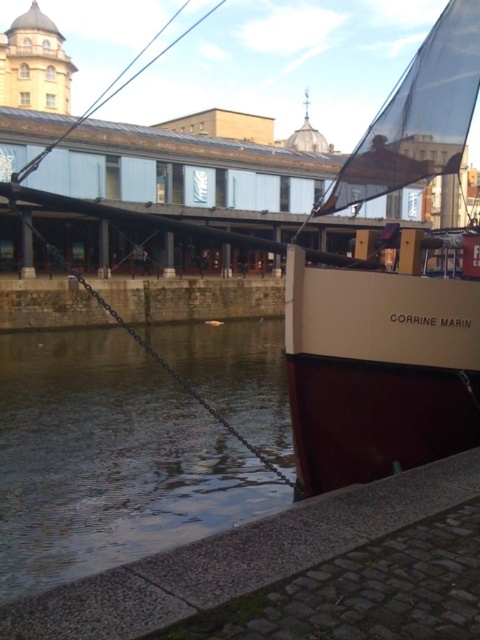
You are standing on the dock and looking at the smooth water at lower left and the beige matte sailboat at right. Which object appears taller from your perspective?

The beige matte sailboat at right appears taller than the smooth water at lower left because the smooth water at lower left is shorter than the beige matte sailboat at right.

You are standing on the dock and want to throw a pebble to the smooth water at lower left. If your throwing range is 5 meters, will you be able to reach it?

The smooth water at lower left is 4.74 meters away from the viewer, so yes, you can reach it with your throwing range of 5 meters.

You are standing on the dock and see the point marked as point (108, 460). What is the closest object to this point?

The smooth water at lower left is represented by point (108, 460), so the closest object to this point is the smooth water at lower left.